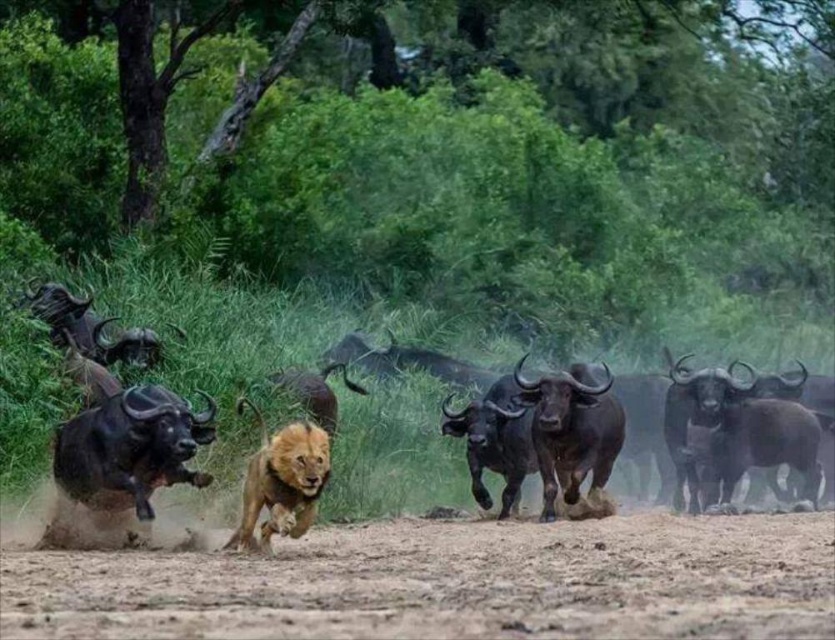
From the picture: You are a wildlife photographer observing the scene. You want to capture a photo where the golden fur lion at center is visible in front of the black glossy buffalo at center. Is this possible given their current positions?

The black glossy buffalo at center is positioned over the golden fur lion at center, so the lion cannot be seen in front of the buffalo in this arrangement.